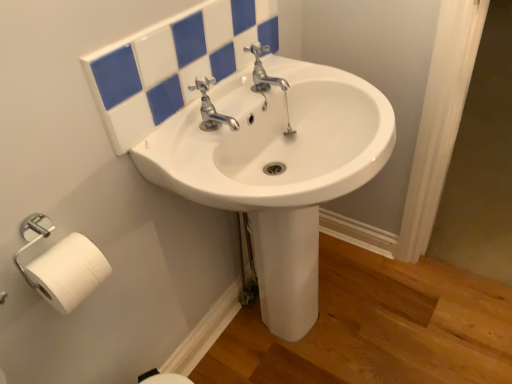
Question: Considering the positions of white glossy sink at center and white matte toilet paper at lower left in the image, is white glossy sink at center taller or shorter than white matte toilet paper at lower left?

Choices:
 (A) tall
 (B) short

Answer: (A)

Question: Is white glossy sink at center bigger or smaller than white matte toilet paper at lower left?

Choices:
 (A) small
 (B) big

Answer: (B)

Question: Estimate the real-world distances between objects in this image. Which object is closer to the white matte toilet paper at lower left?

Choices:
 (A) white glossy mirror at upper center
 (B) white glossy sink at center
 (C) chrome metallic faucet at center

Answer: (A)

Question: Estimate the real-world distances between objects in this image. Which object is closer to the chrome metallic faucet at center?

Choices:
 (A) white glossy sink at center
 (B) white glossy mirror at upper center
 (C) white matte toilet paper at lower left

Answer: (B)